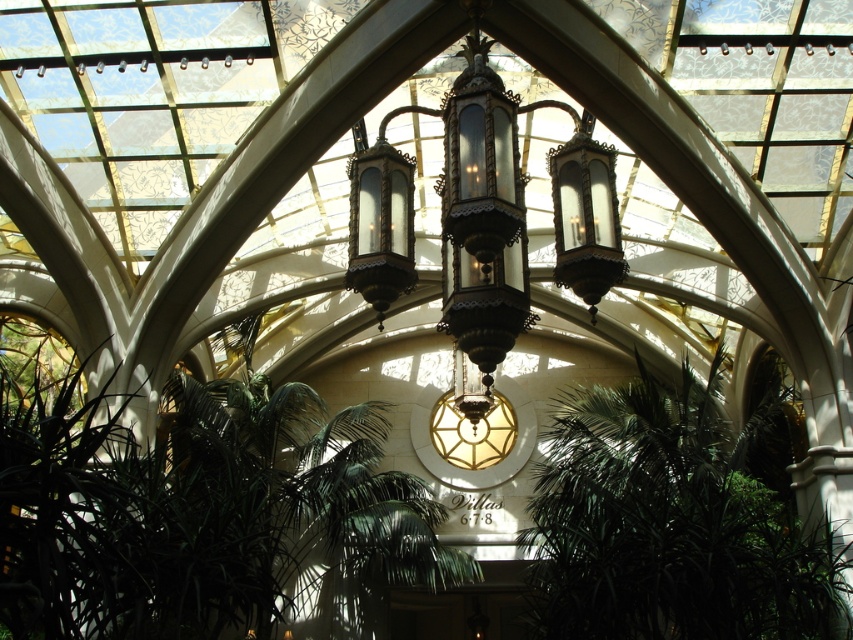
Question: Which of the following is the closest to the observer?

Choices:
 (A) polished brass chandelier at center
 (B) green leafy palm tree at center

Answer: (A)

Question: From the image, what is the correct spatial relationship of green leafy palm tree at center in relation to polished brass chandelier at center?

Choices:
 (A) below
 (B) above

Answer: (A)

Question: Can you confirm if green leafy palm tree at center is thinner than polished brass chandelier at center?

Choices:
 (A) no
 (B) yes

Answer: (A)

Question: Where is green leafy palm tree at center located in relation to polished brass chandelier at center in the image?

Choices:
 (A) left
 (B) right

Answer: (B)

Question: Among these objects, which one is nearest to the camera?

Choices:
 (A) green leafy palm tree at center
 (B) polished brass chandelier at center

Answer: (B)

Question: Among these points, which one is farthest from the camera?

Choices:
 (A) (668, 576)
 (B) (444, 284)

Answer: (A)